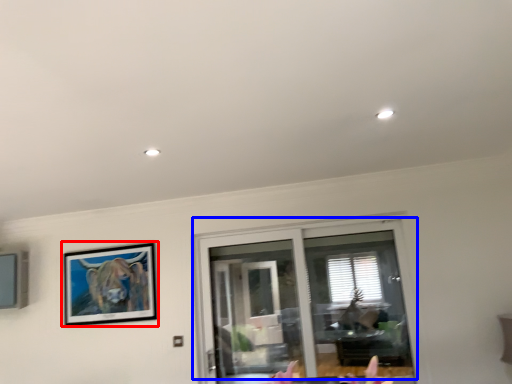
Question: Which of the following is the closest to the observer, picture frame (highlighted by a red box) or window (highlighted by a blue box)?

Choices:
 (A) picture frame
 (B) window

Answer: (B)